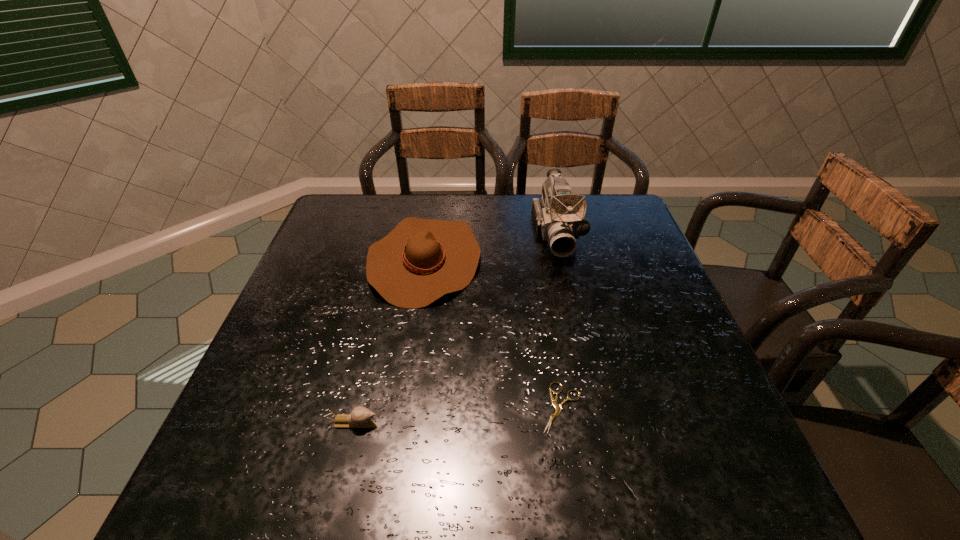
Find the location of a particular element. The width and height of the screenshot is (960, 540). free space at the far edge is located at coordinates (497, 202).

The height and width of the screenshot is (540, 960). In the image, there is a desktop. Find the location of `vacant space at the near edge`. vacant space at the near edge is located at coordinates (401, 492).

In order to click on blank space at the left edge of the desktop in this screenshot , I will do `click(336, 282)`.

At what (x,y) coordinates should I click in order to perform the action: click on free space at the right edge of the desktop. Please return your answer as a coordinate pair (x, y). This screenshot has height=540, width=960. Looking at the image, I should click on (626, 253).

Image resolution: width=960 pixels, height=540 pixels. In order to click on vacant space in between the camcorder and the shortest object in this screenshot , I will do `click(559, 320)`.

Locate an element on the screen. The height and width of the screenshot is (540, 960). empty space between the shortest object and the second tallest object is located at coordinates (493, 334).

This screenshot has width=960, height=540. Identify the location of free space that is in between the second tallest object and the second shortest object. (390, 341).

Find the location of a particular element. This screenshot has width=960, height=540. vacant point located between the shortest object and the escargot is located at coordinates (458, 415).

This screenshot has width=960, height=540. In order to click on free space between the tallest object and the cowboy hat in this screenshot , I will do 491,246.

You are a GUI agent. You are given a task and a screenshot of the screen. Output one action in this format:
    pyautogui.click(x=<x>, y=<y>)
    Task: Click on the empty space that is in between the camcorder and the cowboy hat
    
    Given the screenshot: What is the action you would take?
    click(x=491, y=246)